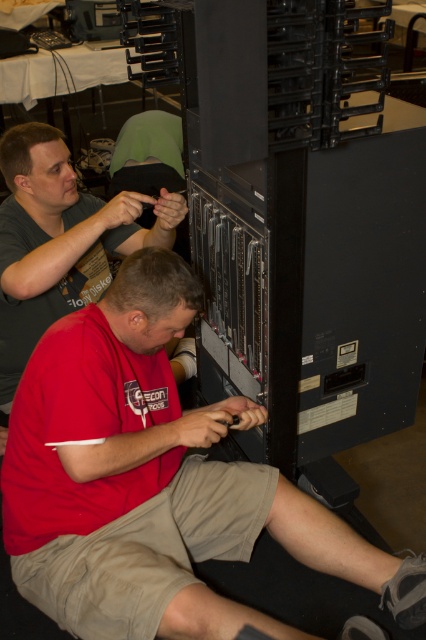
You are a technician needing to pass a tool between the red matte shirt at lower left and the matte black shirt at upper left. Given that the minimum safe distance for passing tools is 24 inches, can you safely hand the tool directly between them?

The red matte shirt at lower left and the matte black shirt at upper left are 23.68 inches apart from each other, which is less than the required 24 inches for safe tool passing. Therefore, handing the tool directly between them may not be safe.